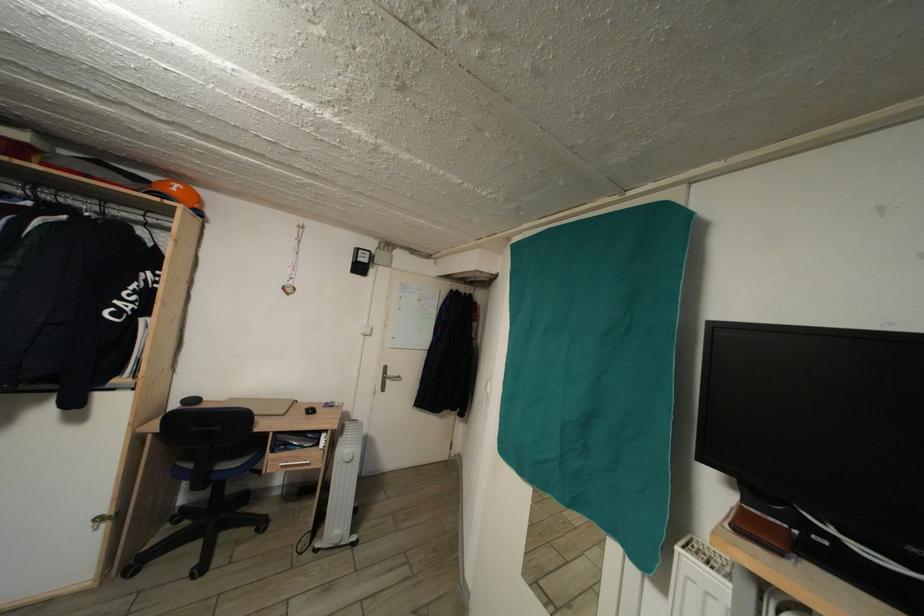
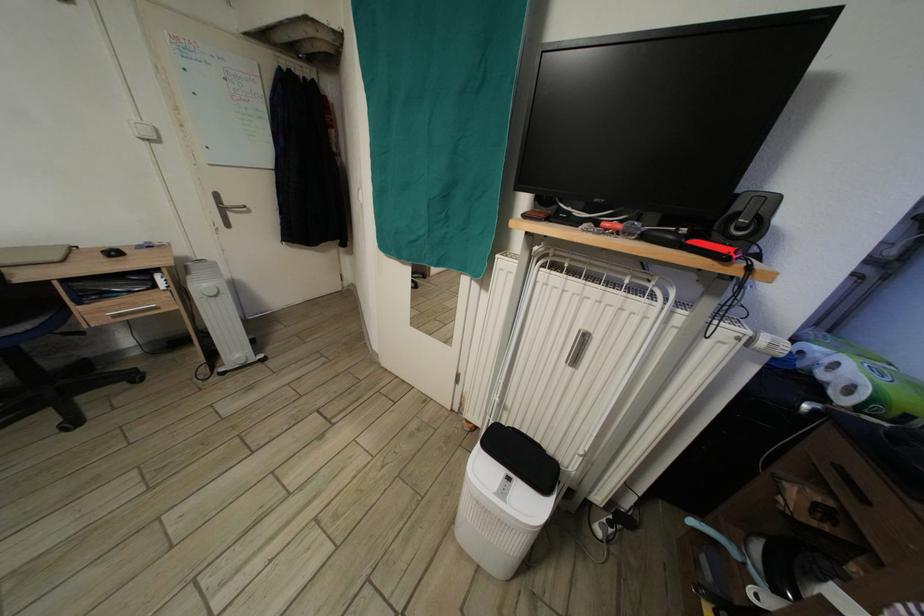
Locate, in the second image, the point that corresponds to point (839, 536) in the first image.

(576, 216)